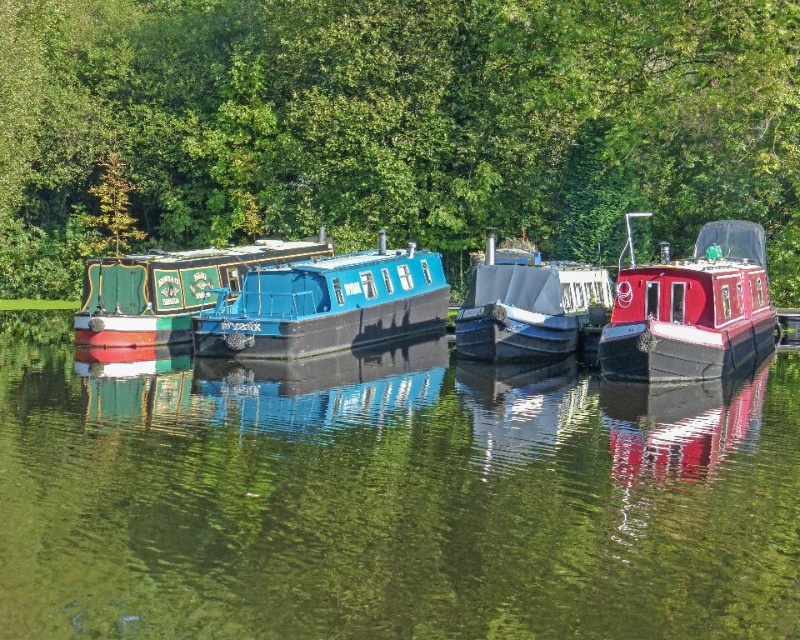
Is green leafy tree at upper center shorter than shiny red boat at right?

No.

Which is below, green leafy tree at upper center or shiny red boat at right?

shiny red boat at right is lower down.

Find the location of a particular element. The image size is (800, 640). green leafy tree at upper center is located at coordinates (394, 124).

Does blue glossy canal boat at center appear on the right side of matte gray cabin cruiser at center?

No, blue glossy canal boat at center is not to the right of matte gray cabin cruiser at center.

Which is behind, point (274, 268) or point (476, 298)?

Point (274, 268)

Locate an element on the screen. The height and width of the screenshot is (640, 800). blue glossy canal boat at center is located at coordinates (326, 305).

Between blue glossy canal boat at center and green painted wood boat at center, which one is positioned lower?

blue glossy canal boat at center

Between point (326, 262) and point (180, 268), which one is positioned in front?

Point (326, 262)

Is point (233, 307) in front of point (130, 291)?

That is True.

Where is `blue glossy canal boat at center`? The height and width of the screenshot is (640, 800). blue glossy canal boat at center is located at coordinates (326, 305).